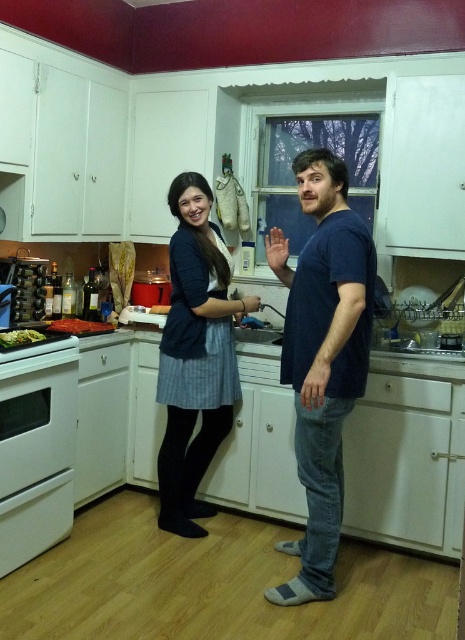
Question: Is red matte pizza at lower left closer to camera compared to green leafy vegetables at stove front?

Choices:
 (A) no
 (B) yes

Answer: (A)

Question: Which object is positioned farthest from the denim skirt at center?

Choices:
 (A) red matte pizza at lower left
 (B) dark blue t-shirt at center
 (C) white glossy oven at lower left

Answer: (A)

Question: Among these points, which one is farthest from the camera?

Choices:
 (A) (314, 182)
 (B) (35, 355)
 (C) (98, 323)

Answer: (C)

Question: Considering the real-world distances, which object is closest to the green leafy vegetables at stove front?

Choices:
 (A) denim skirt at center
 (B) dark blue t-shirt at center
 (C) red matte pizza at lower left

Answer: (C)

Question: Does red matte pizza at lower left appear on the right side of green leafy vegetables at stove front?

Choices:
 (A) no
 (B) yes

Answer: (B)

Question: Does dark blue t-shirt at center come behind green leafy vegetables at stove front?

Choices:
 (A) yes
 (B) no

Answer: (B)